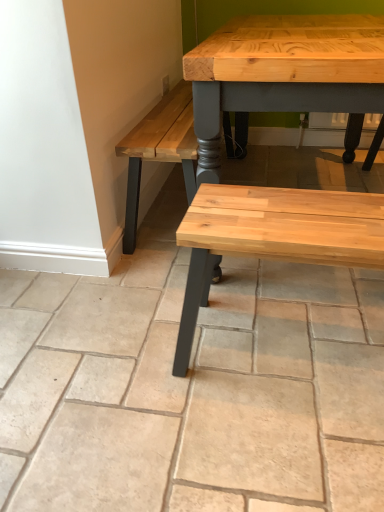
This screenshot has width=384, height=512. What do you see at coordinates (273, 236) in the screenshot?
I see `natural wood bench at center` at bounding box center [273, 236].

Where is `natural wood bench at center`? natural wood bench at center is located at coordinates (273, 236).

At what (x,y) coordinates should I click in order to perform the action: click on natural stone bench at center. Please return your answer as a coordinate pair (x, y). The width and height of the screenshot is (384, 512). Looking at the image, I should click on (192, 389).

Describe the element at coordinates (192, 389) in the screenshot. I see `natural stone bench at center` at that location.

Locate an element on the screen. natural wood bench at center is located at coordinates (273, 236).

Visually, is natural wood bench at center positioned to the left or to the right of natural stone bench at center?

From the image, it's evident that natural wood bench at center is to the right of natural stone bench at center.

Between natural wood bench at center and natural stone bench at center, which one is positioned behind?

natural wood bench at center is more distant.

Which is closer, (281, 201) or (123, 355)?

Clearly, point (281, 201) is closer to the camera than point (123, 355).

From the image's perspective, which one is positioned higher, natural wood bench at center or natural stone bench at center?

From the image's view, natural stone bench at center is above.

From a real-world perspective, who is located lower, natural wood bench at center or natural stone bench at center?

→ natural stone bench at center, from a real-world perspective.

Considering the sizes of natural wood bench at center and natural stone bench at center in the image, is natural wood bench at center wider or thinner than natural stone bench at center?

Considering their sizes, natural wood bench at center looks slimmer than natural stone bench at center.

Does natural wood bench at center have a greater height compared to natural stone bench at center?

Correct, natural wood bench at center is much taller as natural stone bench at center.

Is natural wood bench at center bigger than natural stone bench at center?

No.

Choose the correct answer: Is natural wood bench at center inside natural stone bench at center or outside it?

The correct answer is: outside.

Is the surface of natural wood bench at center in direct contact with natural stone bench at center?

There is a gap between natural wood bench at center and natural stone bench at center.

Is natural wood bench at center aimed at natural stone bench at center?

No, natural wood bench at center is not aimed at natural stone bench at center.

Based on the photo, how different are the orientations of natural wood bench at center and natural stone bench at center in degrees?

90.5 degrees separate the facing orientations of natural wood bench at center and natural stone bench at center.

Where is `bench on the right of natural stone bench at center`? This screenshot has height=512, width=384. bench on the right of natural stone bench at center is located at coordinates (273, 236).

Which is more to the left, natural stone bench at center or natural wood bench at center?

Positioned to the left is natural stone bench at center.

Which object is closer to the camera taking this photo, natural stone bench at center or natural wood bench at center?

Positioned in front is natural stone bench at center.

Is point (148, 490) closer or farther from the camera than point (363, 219)?

Point (148, 490).

From the image's perspective, between natural stone bench at center and natural wood bench at center, who is located below?

natural wood bench at center appears lower in the image.

From a real-world perspective, which is physically below, natural stone bench at center or natural wood bench at center?

From a 3D spatial view, natural stone bench at center is below.

Does natural stone bench at center have a lesser width compared to natural wood bench at center?

No.

In the scene shown: Is natural stone bench at center taller than natural wood bench at center?

Incorrect, the height of natural stone bench at center is not larger of that of natural wood bench at center.

Considering the relative sizes of natural stone bench at center and natural wood bench at center in the image provided, is natural stone bench at center bigger than natural wood bench at center?

Indeed, natural stone bench at center has a larger size compared to natural wood bench at center.

Would you say natural stone bench at center is inside or outside natural wood bench at center?

The correct answer is: outside.

Is natural stone bench at center directly adjacent to natural wood bench at center?

natural stone bench at center and natural wood bench at center are not in contact.

Does natural stone bench at center turn towards natural wood bench at center?

No, natural stone bench at center is not facing towards natural wood bench at center.

How different are the orientations of natural stone bench at center and natural wood bench at center in degrees?

90.5 degrees.

Locate an element on the screen. The height and width of the screenshot is (512, 384). bench above the natural stone bench at center (from a real-world perspective) is located at coordinates coord(273,236).

Identify the location of bench located below the natural stone bench at center (from the image's perspective). (273, 236).

You are a GUI agent. You are given a task and a screenshot of the screen. Output one action in this format:
    pyautogui.click(x=<x>, y=<y>)
    Task: Click on the concrete above the natural wood bench at center (from the image's perspective)
    The width and height of the screenshot is (384, 512).
    Given the screenshot: What is the action you would take?
    192,389